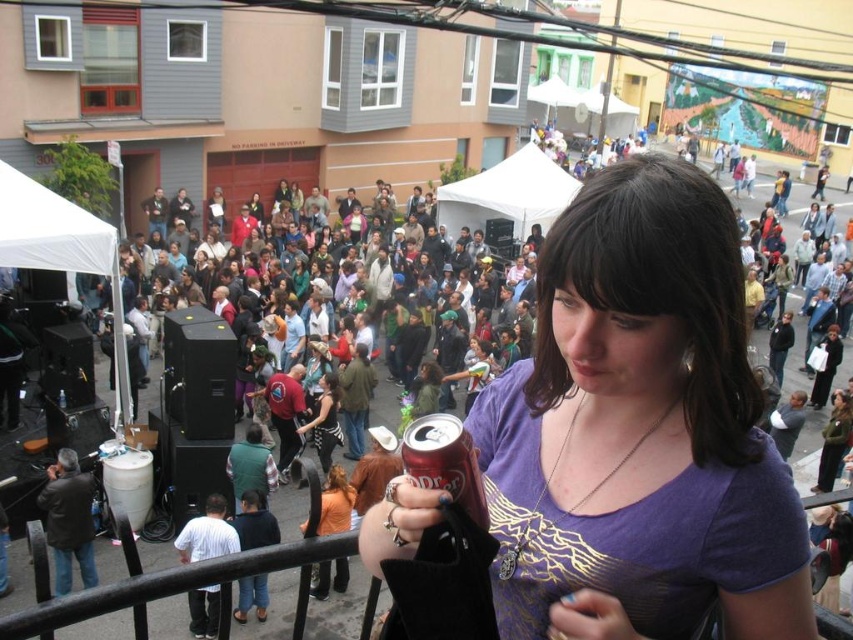
Question: Which of the following is the farthest from the observer?

Choices:
 (A) matte black jacket at center
 (B) black and white striped dress at center
 (C) purple matte shirt at center

Answer: (A)

Question: Which object is the closest to the metallic red can at center?

Choices:
 (A) purple matte shirt at center
 (B) black and white striped dress at center

Answer: (A)

Question: Does purple matte shirt at center appear on the left side of matte black jacket at center?

Choices:
 (A) yes
 (B) no

Answer: (B)

Question: Is purple matte shirt at center positioned before metallic red can at center?

Choices:
 (A) yes
 (B) no

Answer: (A)

Question: Estimate the real-world distances between objects in this image. Which object is farther from the matte black jacket at center?

Choices:
 (A) metallic red can at center
 (B) purple matte shirt at center

Answer: (B)

Question: Can you confirm if black and white striped dress at center is positioned above matte black jacket at center?

Choices:
 (A) yes
 (B) no

Answer: (B)